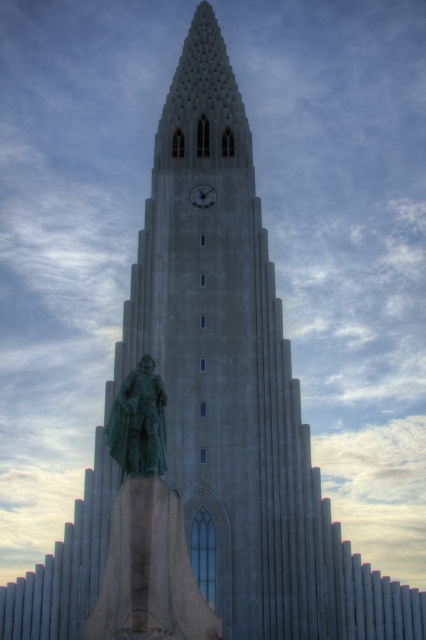
Question: Which point is farther from the camera taking this photo?

Choices:
 (A) click(207, 204)
 (B) click(157, 440)

Answer: (A)

Question: Is green patina statue at center to the left of metallic gray clock at upper center from the viewer's perspective?

Choices:
 (A) yes
 (B) no

Answer: (A)

Question: Which object is farther from the camera taking this photo?

Choices:
 (A) green patina statue at center
 (B) metallic gray clock at upper center

Answer: (B)

Question: Is green patina statue at center to the right of metallic gray clock at upper center from the viewer's perspective?

Choices:
 (A) no
 (B) yes

Answer: (A)

Question: Which of the following is the closest to the observer?

Choices:
 (A) (138, 406)
 (B) (213, 189)

Answer: (A)

Question: Where is green patina statue at center located in relation to metallic gray clock at upper center in the image?

Choices:
 (A) left
 (B) right

Answer: (A)